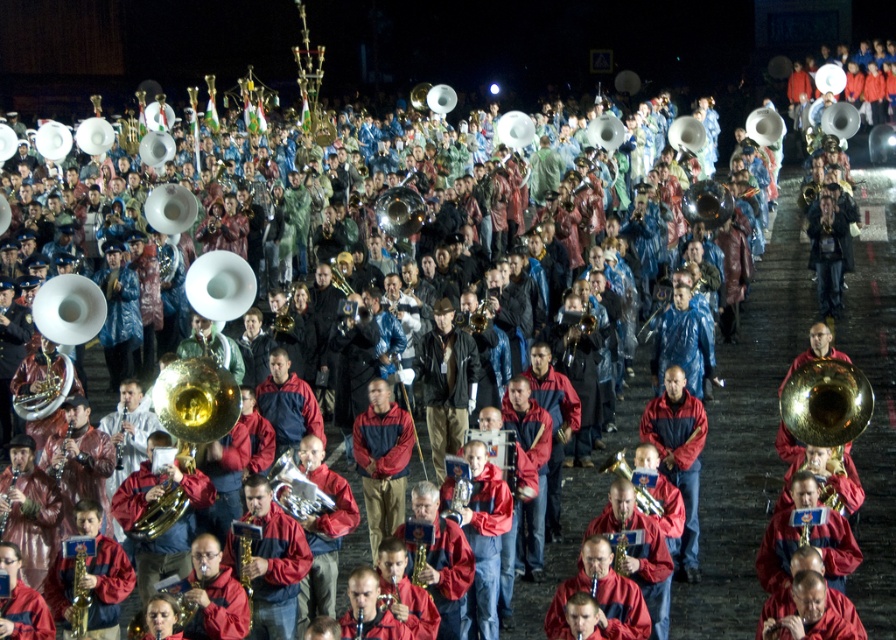
You are a member of the marching band in the nighttime scene. You need to move from your current position at point (121, 452) to a new position at point (295, 509). Given the dense crowd around you, will you be able to move forward to reach your destination without going behind your original position?

Point (295, 509) is in front of point (121, 452), so yes, you can move forward to reach your destination without going behind your original position.

You are a photographer standing behind the band. You want to take a photo that includes both the gold brass saxophone at lower left and the gold brass saxophone at center. What is the minimum distance you need to move backward to ensure both saxophones are fully visible in your camera frame?

The two saxophones are 2.14 meters apart. To include both in the frame, you need to move backward until the distance between them fits within your camera lens field of view. The exact distance depends on your lens focal length and sensor size, but generally, increasing the distance from the subjects widens the field of view, allowing both to be captured.

You are a photographer trying to capture the gold brass saxophone at lower left in the nighttime scene. The scene has a point at coordinates (78, 582). Where should you aim your camera to ensure you include the gold brass saxophone at lower left in your photo?

The point at coordinates (78, 582) corresponds to the gold brass saxophone at lower left, so aim your camera at that point to include it in the photo.